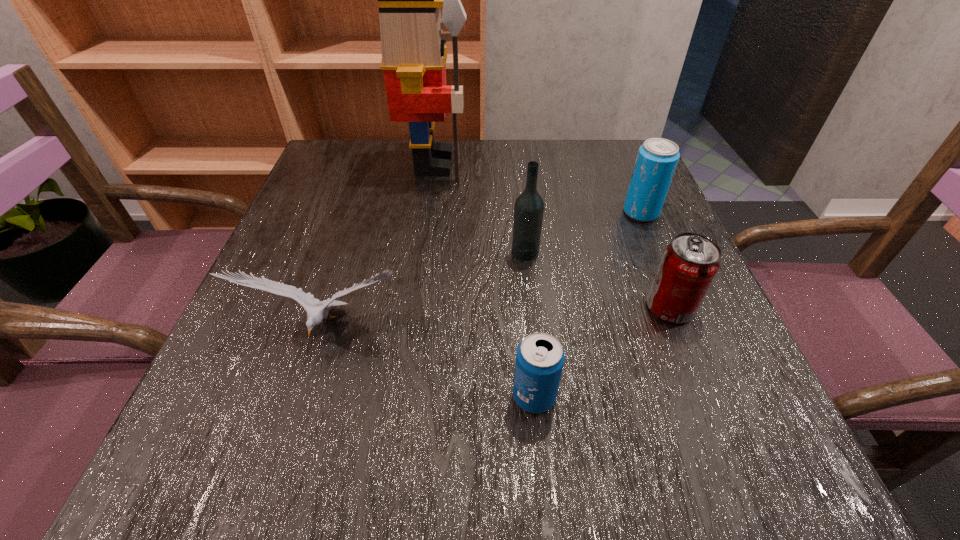
Where is `vacant space located 0.080m on the left of the fourth nearest object`? vacant space located 0.080m on the left of the fourth nearest object is located at coordinates (469, 252).

At what (x,y) coordinates should I click in order to perform the action: click on vacant space located on the front of the farthest soda can. Please return your answer as a coordinate pair (x, y). Image resolution: width=960 pixels, height=540 pixels. Looking at the image, I should click on (680, 304).

This screenshot has height=540, width=960. I want to click on free spot located 0.130m at the tip of the beak of the gull, so (x=292, y=441).

The height and width of the screenshot is (540, 960). In order to click on blank space located 0.190m on the left of the second farthest soda can in this screenshot , I will do `click(533, 308)`.

At what (x,y) coordinates should I click in order to perform the action: click on free spot located on the front of the nearest soda can. Please return your answer as a coordinate pair (x, y). Image resolution: width=960 pixels, height=540 pixels. Looking at the image, I should click on (541, 476).

The width and height of the screenshot is (960, 540). I want to click on object located in the far edge section of the desktop, so click(414, 56).

The width and height of the screenshot is (960, 540). I want to click on object that is positioned at the left edge, so click(x=317, y=310).

Find the location of `vacant space at the far edge of the desktop`. vacant space at the far edge of the desktop is located at coordinates (416, 191).

This screenshot has height=540, width=960. In the image, there is a desktop. Find the location of `vacant space at the near edge`. vacant space at the near edge is located at coordinates (343, 487).

Locate an element on the screen. Image resolution: width=960 pixels, height=540 pixels. vacant area at the left edge is located at coordinates (323, 377).